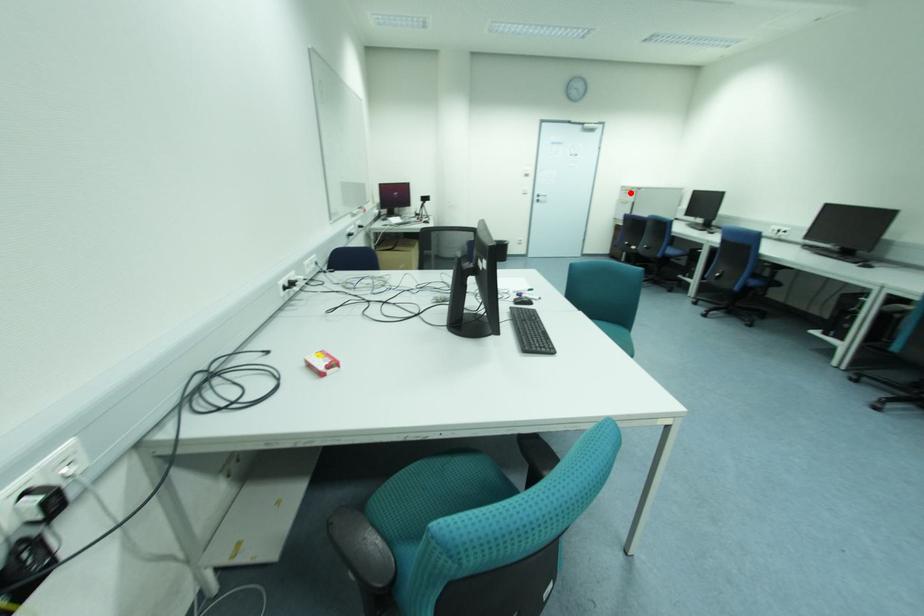
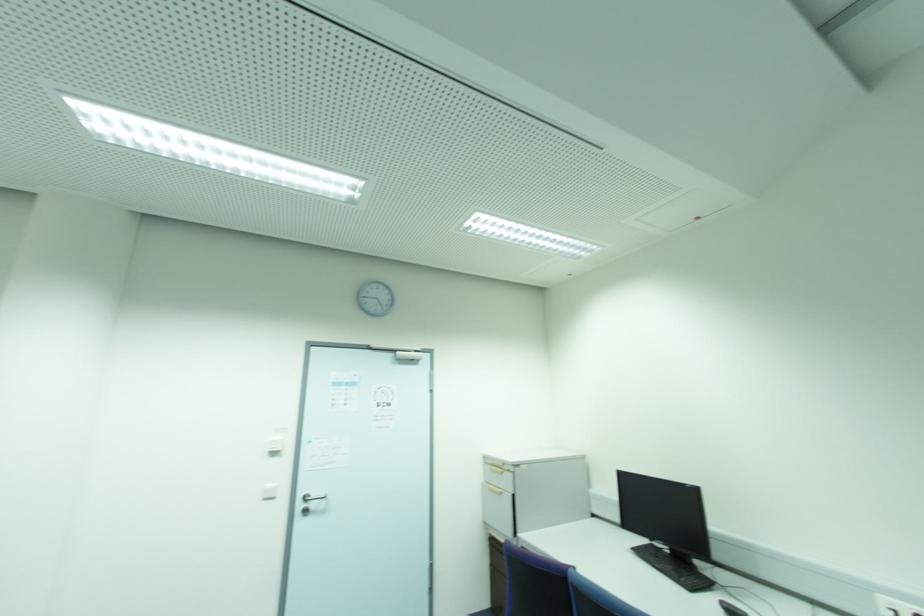
In the second image, find the point that corresponds to the highlighted location in the first image.

(503, 472)